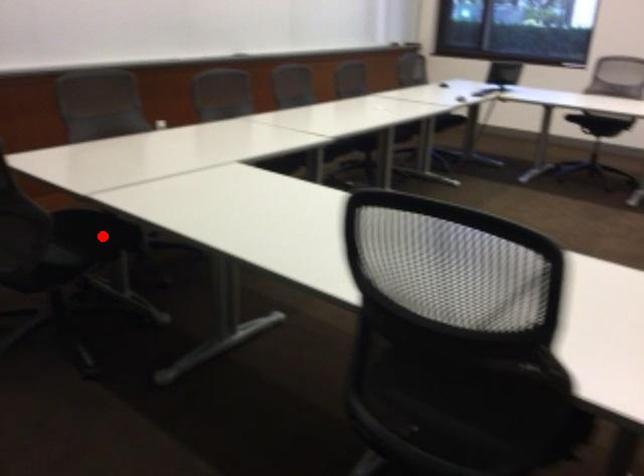
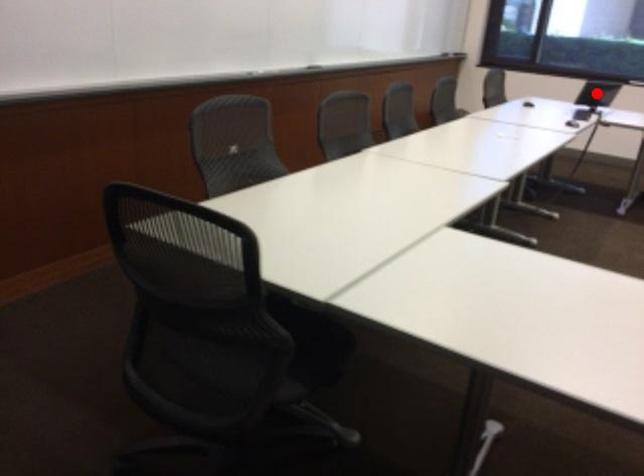
I am providing you with two images of the same scene from different viewpoints. A red point is marked on the first image and another point is marked on the second image. Do the highlighted points in image1 and image2 indicate the same real-world spot?

No